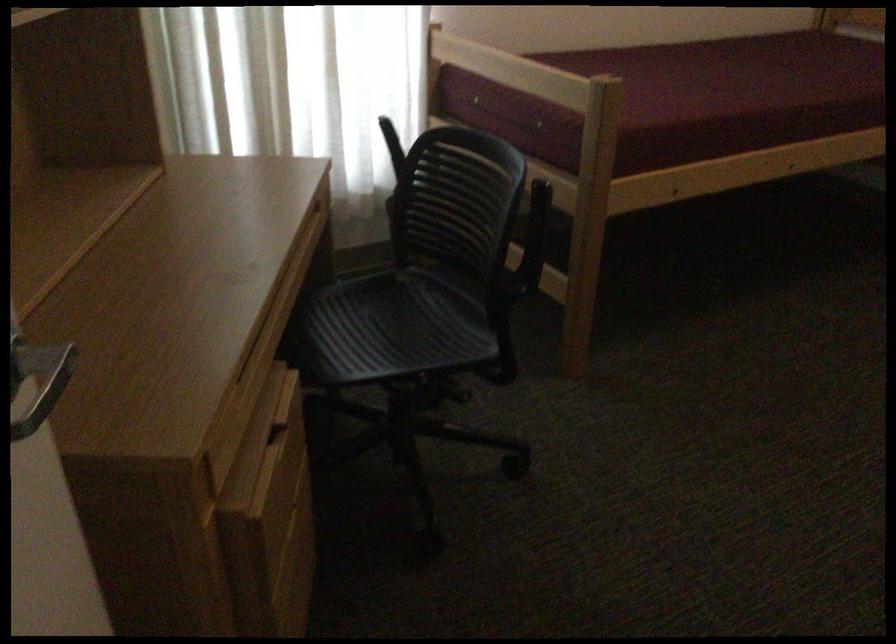
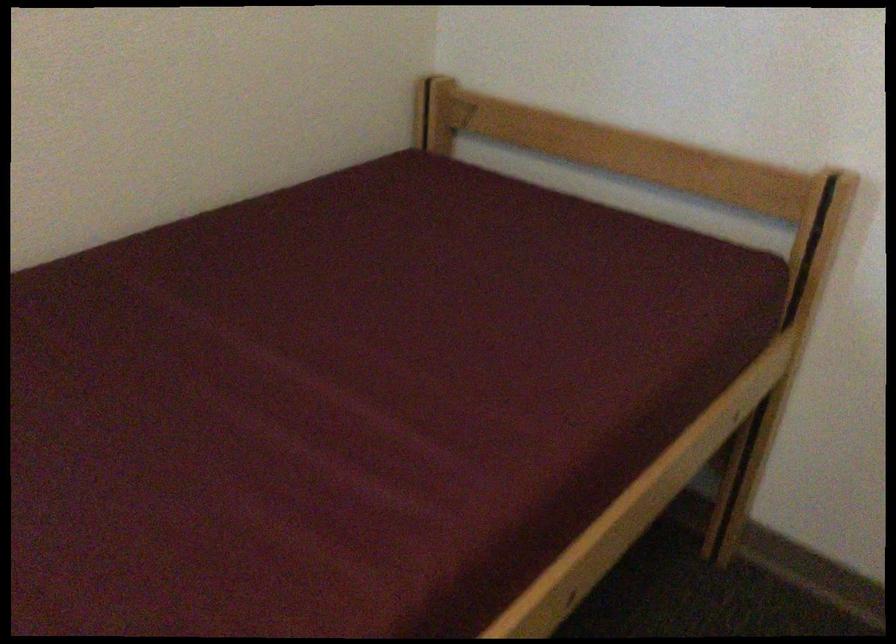
Which direction would the cameraman need to move to produce the second image?

The cameraman walked toward right, forward.